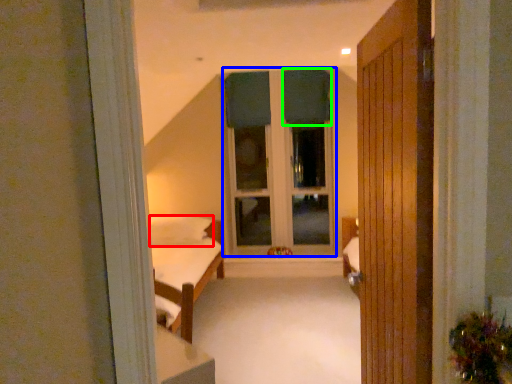
Question: Estimate the real-world distances between objects in this image. Which object is farther from pillow (highlighted by a red box), bay window (highlighted by a blue box) or curtain (highlighted by a green box)?

Choices:
 (A) bay window
 (B) curtain

Answer: (B)